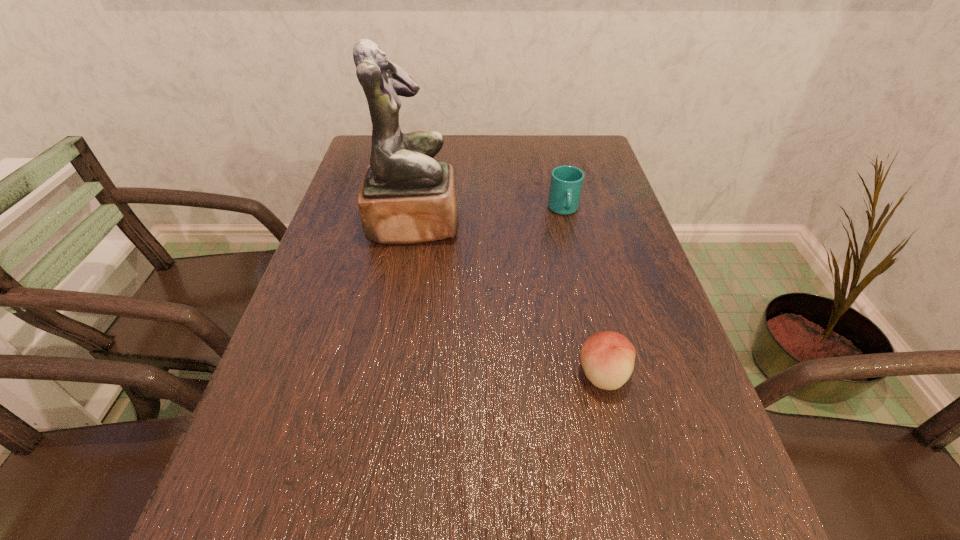
At what (x,y) coordinates should I click in order to perform the action: click on peach situated at the right edge. Please return your answer as a coordinate pair (x, y). Looking at the image, I should click on (607, 357).

Image resolution: width=960 pixels, height=540 pixels. Find the location of `vacant space at the far edge of the desktop`. vacant space at the far edge of the desktop is located at coordinates (521, 152).

You are a GUI agent. You are given a task and a screenshot of the screen. Output one action in this format:
    pyautogui.click(x=<x>, y=<y>)
    Task: Click on the vacant region at the left edge of the desktop
    The height and width of the screenshot is (540, 960).
    Given the screenshot: What is the action you would take?
    pyautogui.click(x=372, y=247)

In the image, there is a desktop. Where is `vacant space at the right edge`? This screenshot has height=540, width=960. vacant space at the right edge is located at coordinates (659, 474).

In order to click on free space at the far left corner of the desktop in this screenshot , I will do `click(361, 143)`.

Where is `free location at the far right corner`? free location at the far right corner is located at coordinates (595, 161).

This screenshot has width=960, height=540. Find the location of `vacant space that's between the cup and the leftmost object`. vacant space that's between the cup and the leftmost object is located at coordinates (489, 217).

Find the location of `vacant area that lies between the cup and the sculpture`. vacant area that lies between the cup and the sculpture is located at coordinates (489, 217).

The height and width of the screenshot is (540, 960). I want to click on free space that is in between the tallest object and the cup, so click(x=489, y=217).

At what (x,y) coordinates should I click in order to perform the action: click on empty space between the shortest object and the tallest object. Please return your answer as a coordinate pair (x, y). The width and height of the screenshot is (960, 540). Looking at the image, I should click on (509, 299).